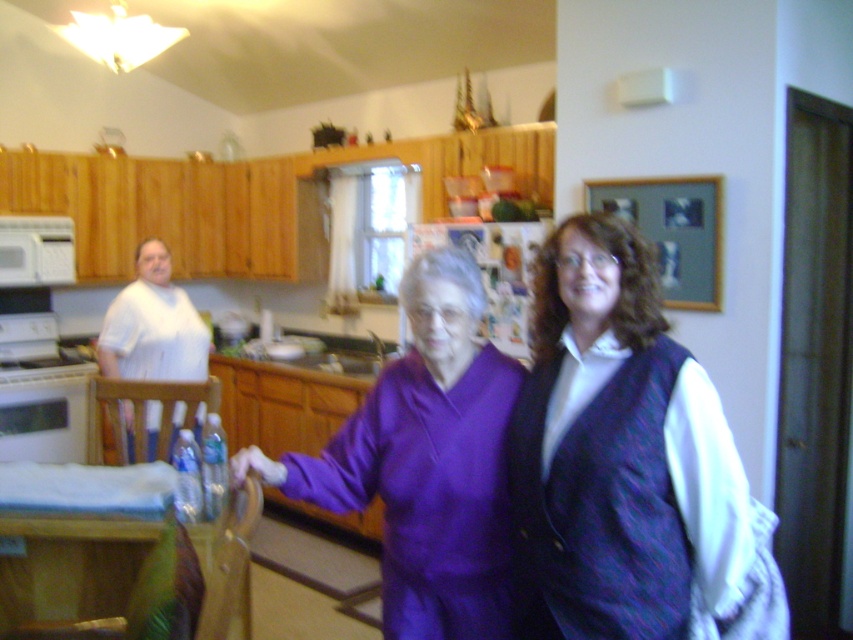
You are a photographer setting up a shot in this kitchen scene. You need to place a small prop exactly at the coordinates mentioned in the scene description. Where should you place the prop relative to the purple fabric at center?

The prop should be placed exactly at the coordinates of the purple fabric at center, which is at point [628,464].

You are a chef standing in the kitchen and need to reach the white glossy stove at left. There is a purple satin blouse at center in your way. Can you move the blouse to access the stove?

The purple satin blouse at center is positioned under the white glossy stove at left, so it is not blocking the stove and does not need to be moved to access it.